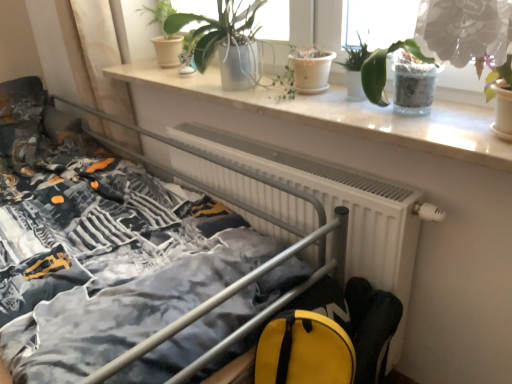
I want to click on vacant space in translucent glass pot at upper right, arranged as the fourth houseplant when viewed from the left (from a real-world perspective), so click(392, 109).